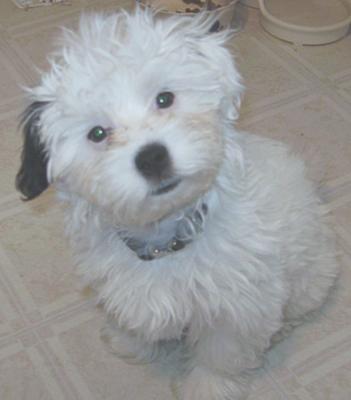
This screenshot has width=351, height=400. What are the coordinates of `food bowl` in the screenshot? It's located at (189, 8).